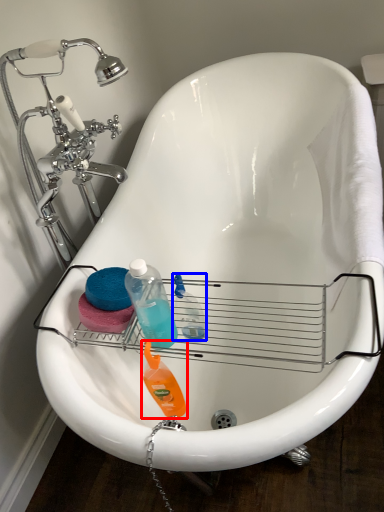
Question: Which of the following is the closest to the observer, cleaning product (highlighted by a red box) or cleaning product (highlighted by a blue box)?

Choices:
 (A) cleaning product
 (B) cleaning product

Answer: (A)